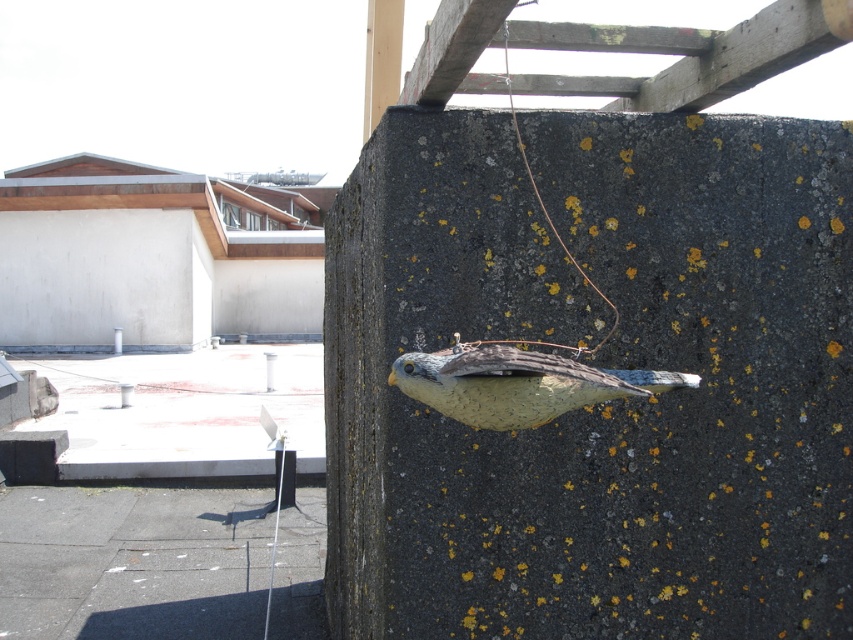
Question: Is speckled concrete bird at center to the left of speckled clay bird at center from the viewer's perspective?

Choices:
 (A) no
 (B) yes

Answer: (A)

Question: Among these points, which one is nearest to the camera?

Choices:
 (A) (598, 400)
 (B) (386, 269)

Answer: (A)

Question: Is speckled concrete bird at center above speckled clay bird at center?

Choices:
 (A) yes
 (B) no

Answer: (B)

Question: Does speckled concrete bird at center come behind speckled clay bird at center?

Choices:
 (A) no
 (B) yes

Answer: (B)